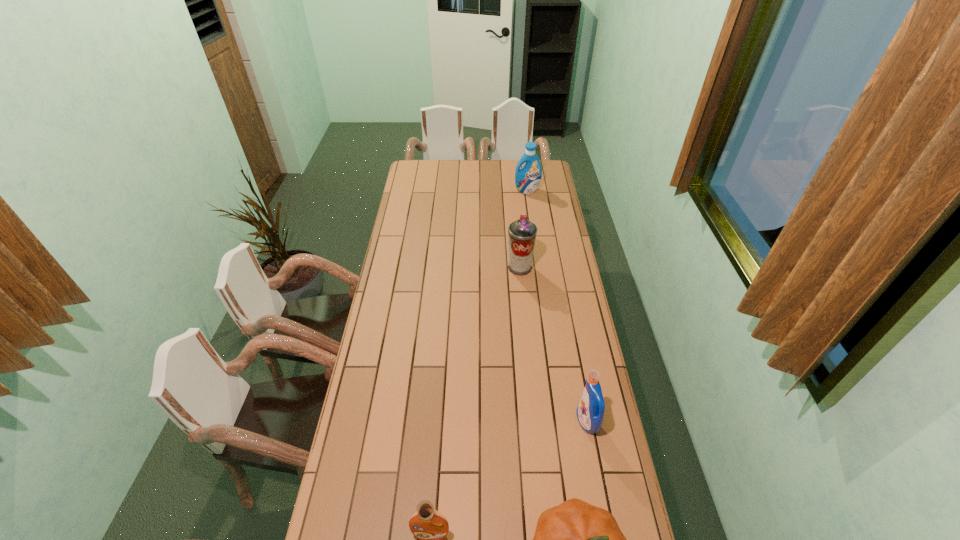
In the image, there is a desktop. In order to click on vacant space at the left edge in this screenshot , I will do `click(395, 387)`.

Where is `vacant point at the right edge`? This screenshot has height=540, width=960. vacant point at the right edge is located at coordinates (560, 229).

This screenshot has width=960, height=540. Find the location of `vacant space that is in between the fourth nearest object and the third farthest object`. vacant space that is in between the fourth nearest object and the third farthest object is located at coordinates (554, 345).

What are the coordinates of `free space between the aerosol can and the second nearest detergent` in the screenshot? It's located at (554, 345).

Locate an element on the screen. This screenshot has width=960, height=540. object identified as the closest to the second farthest object is located at coordinates (527, 179).

Identify which object is the second closest to the farthest object. Please provide its 2D coordinates. Your answer should be formatted as a tuple, i.e. [(x, y)], where the tuple contains the x and y coordinates of a point satisfying the conditions above.

[(590, 412)]

Locate which detergent is the second closest to the farthest detergent. Please provide its 2D coordinates. Your answer should be formatted as a tuple, i.e. [(x, y)], where the tuple contains the x and y coordinates of a point satisfying the conditions above.

[(428, 525)]

Point out which detergent is positioned as the nearest to the tallest detergent. Please provide its 2D coordinates. Your answer should be formatted as a tuple, i.e. [(x, y)], where the tuple contains the x and y coordinates of a point satisfying the conditions above.

[(590, 412)]